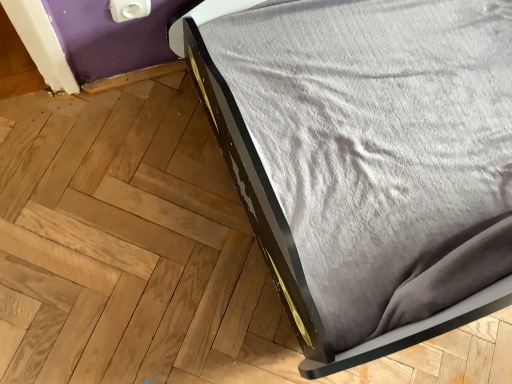
The height and width of the screenshot is (384, 512). What do you see at coordinates (366, 160) in the screenshot?
I see `satin gray bed at center` at bounding box center [366, 160].

Locate an element on the screen. This screenshot has height=384, width=512. satin gray bed at center is located at coordinates (366, 160).

In order to face satin gray bed at center, should I rotate leftwards or rightwards?

Turn right approximately 26.780 degrees to face it.

You are a GUI agent. You are given a task and a screenshot of the screen. Output one action in this format:
    pyautogui.click(x=<x>, y=<y>)
    Task: Click on the satin gray bed at center
    
    Given the screenshot: What is the action you would take?
    pyautogui.click(x=366, y=160)